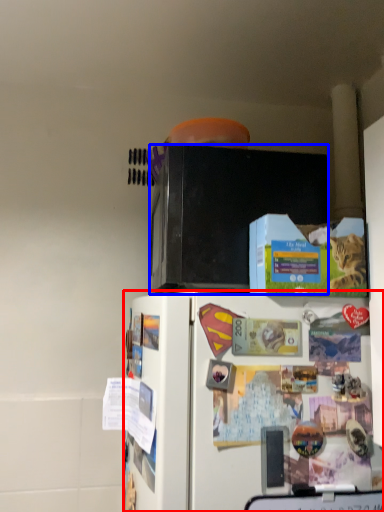
Question: Among these objects, which one is farthest to the camera, refrigerator (highlighted by a red box) or microwave oven (highlighted by a blue box)?

Choices:
 (A) refrigerator
 (B) microwave oven

Answer: (B)